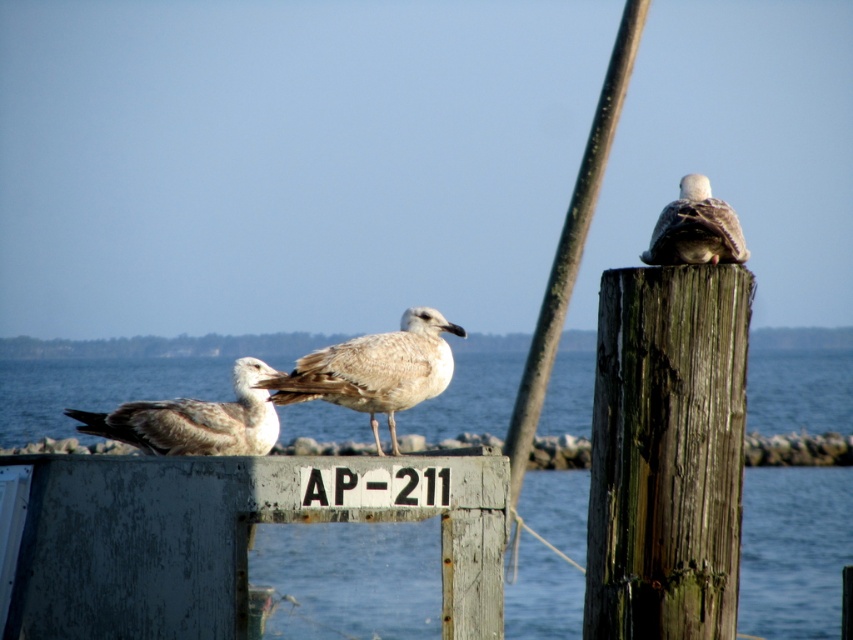
Question: Among these objects, which one is farthest from the camera?

Choices:
 (A) blue water at center
 (B) weathered wood post at upper right

Answer: (A)

Question: Among these objects, which one is farthest from the camera?

Choices:
 (A) light brown feathered seagull at center
 (B) white feathered bird at upper right

Answer: (A)

Question: Based on their relative distances, which object is farther from the light brown feathered seagull at center?

Choices:
 (A) light brown feathered seagull at left
 (B) white feathered bird at upper right

Answer: (B)

Question: From the image, what is the correct spatial relationship of rusty metal sign at center in relation to weathered wood post at upper right?

Choices:
 (A) above
 (B) below

Answer: (B)

Question: Is light brown feathered seagull at center to the right of white feathered bird at upper right from the viewer's perspective?

Choices:
 (A) no
 (B) yes

Answer: (A)

Question: Can you confirm if blue water at center is bigger than weathered wood post at upper right?

Choices:
 (A) no
 (B) yes

Answer: (B)